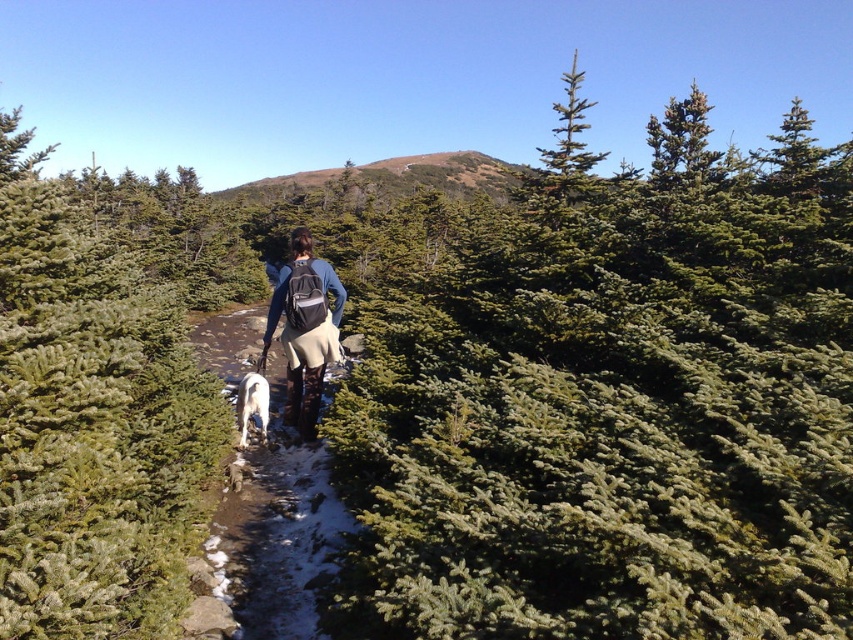
You are a hiker trying to navigate through the forest path. You notice the matte black backpack at center and the brown grassy hillside at center. Which object is narrower in width?

The matte black backpack at center is thinner than the brown grassy hillside at center, so the backpack is narrower in width.

You are a hiker trying to identify the nearest vegetation to your current position, which is at point (618, 406). What type of vegetation is closest to you?

The nearest vegetation to your current position at point (618, 406) is green needle like at center.

You are a hiker trying to navigate a narrow path through the forest. You notice the matte black backpack at center and the brown grassy hillside at center. Which object is positioned lower in the scene?

The matte black backpack at center is below the brown grassy hillside at center, so it is positioned lower in the scene.